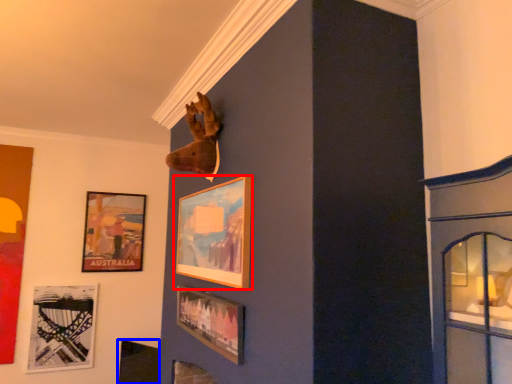
Question: Which of the following is the closest to the observer, picture frame (highlighted by a red box) or picture frame (highlighted by a blue box)?

Choices:
 (A) picture frame
 (B) picture frame

Answer: (A)